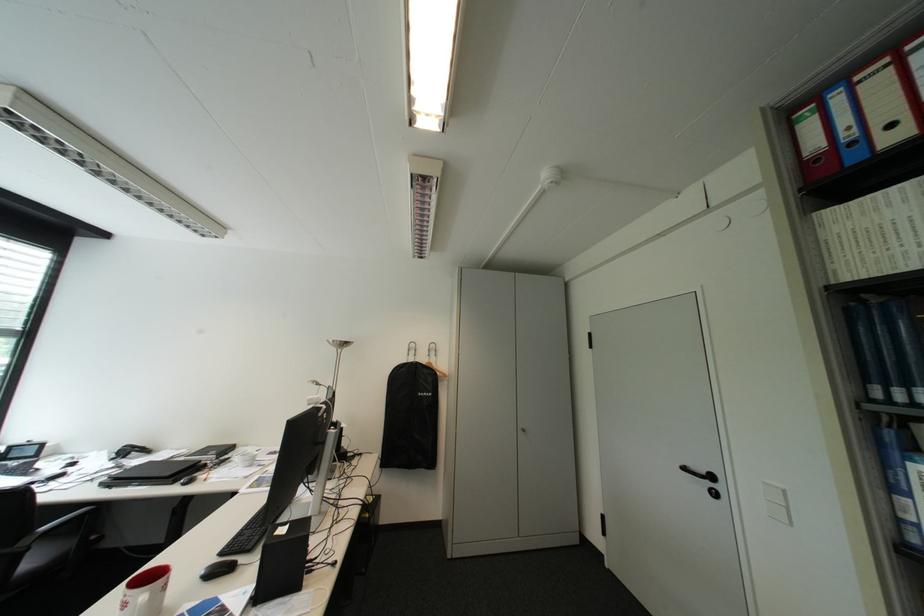
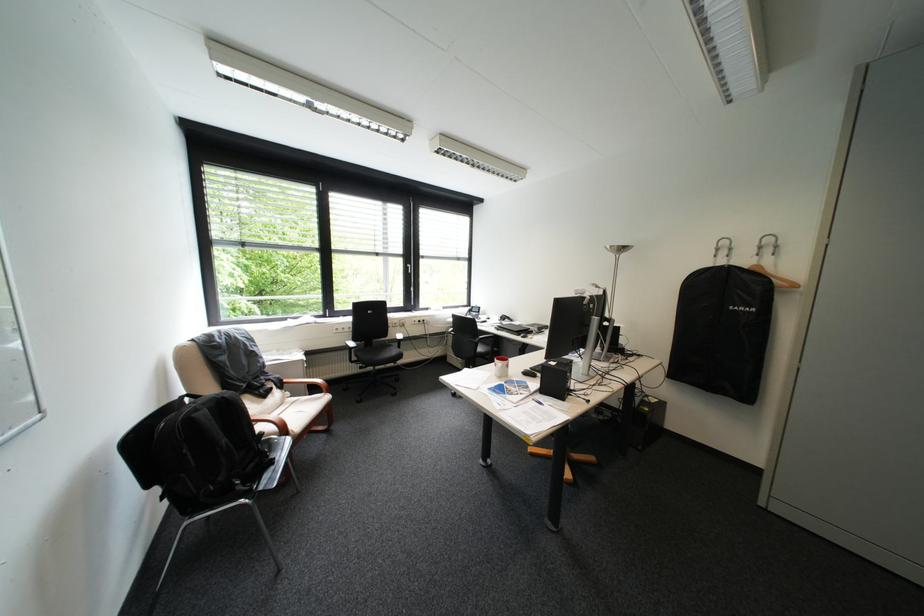
The point at (x=447, y=351) is marked in the first image. Where is the corresponding point in the second image?

(788, 246)